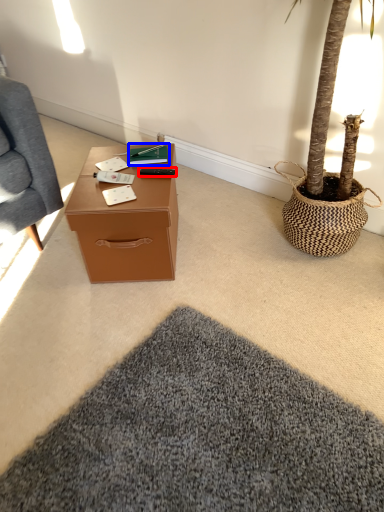
Question: Which of the following is the closest to the observer, remote control (highlighted by a red box) or book (highlighted by a blue box)?

Choices:
 (A) remote control
 (B) book

Answer: (A)